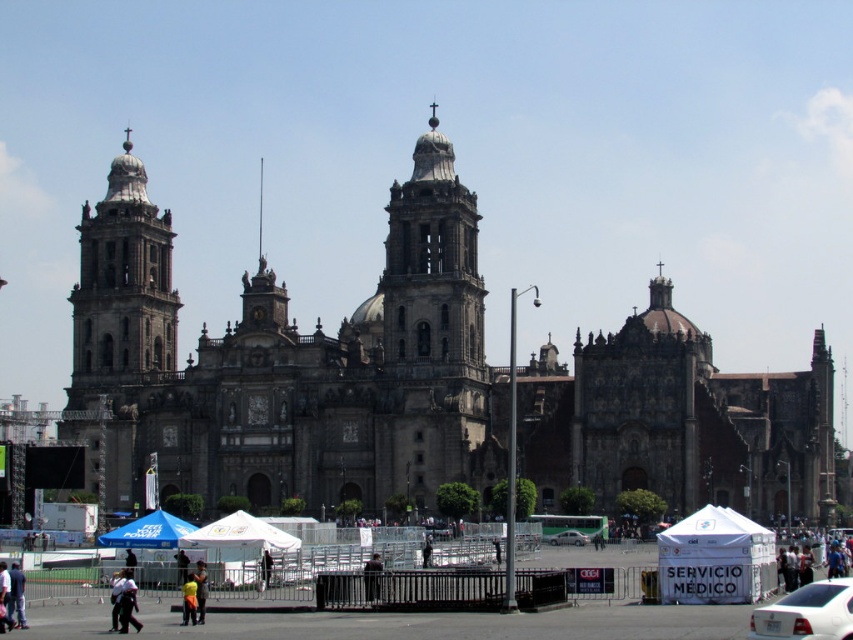
Does white cotton shirt at lower left have a greater width compared to black fabric umbrella at center?

Correct, the width of white cotton shirt at lower left exceeds that of black fabric umbrella at center.

Who is more forward, (131,616) or (264,560)?

Positioned in front is point (131,616).

Where is `white cotton shirt at lower left`? white cotton shirt at lower left is located at coordinates (128, 604).

Who is more forward, (368,595) or (187,588)?

Point (187,588) is in front.

Image resolution: width=853 pixels, height=640 pixels. I want to click on black leather jacket at lower center, so click(372, 577).

How distant is white glossy sedan at lower right from black fabric umbrella at center?

28.62 meters

Between point (845, 593) and point (267, 566), which one is positioned behind?

The point (267, 566) is more distant.

Who is more forward, (775, 618) or (259, 570)?

Positioned in front is point (775, 618).

In order to click on white glossy sedan at lower right in this screenshot , I will do `click(805, 612)`.